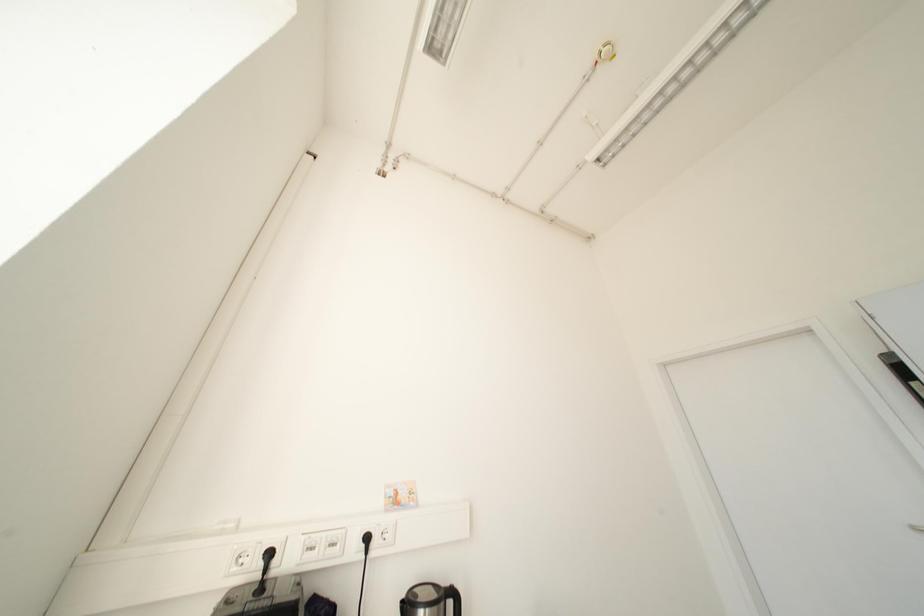
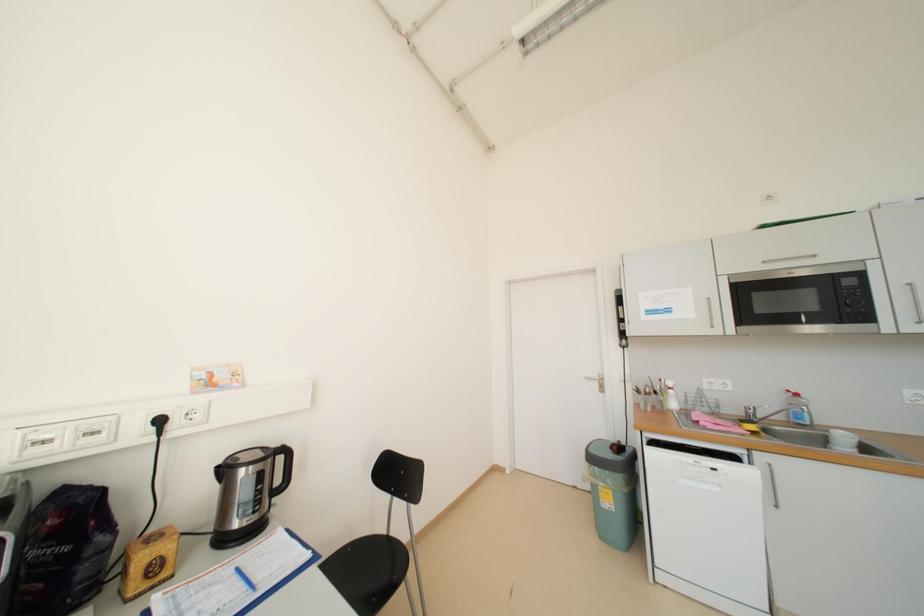
From the picture: How did the camera likely rotate?

The camera's rotation is toward right-down.